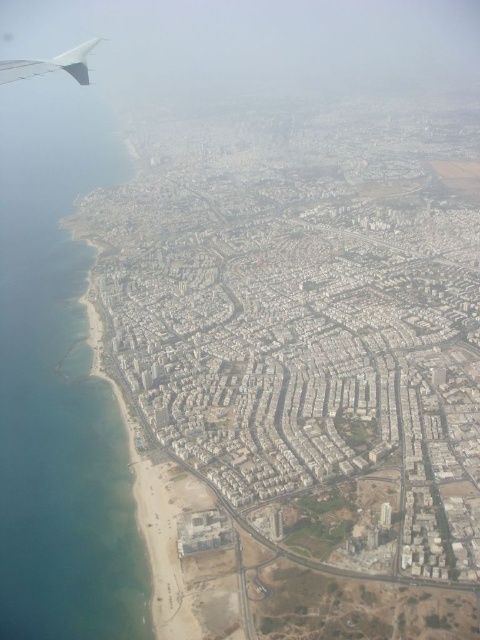
You are a pilot flying an airplane and you notice the blue water at left and the matte gray winglet at upper left from your current position. Which object is wider in the image?

The blue water at left is wider than the matte gray winglet at upper left according to the description.

You are a pilot observing the city from the airplane window. You notice the blue water at left and the matte gray winglet at upper left. Which object appears taller in the image?

The blue water at left appears taller than the matte gray winglet at upper left according to the description.

You are a pilot preparing to land the plane. You notice the blue water at left and the matte gray winglet at upper left. Which of these two objects appears larger in the current view from the airplane window?

The blue water at left appears larger than the matte gray winglet at upper left in the current view from the airplane window.